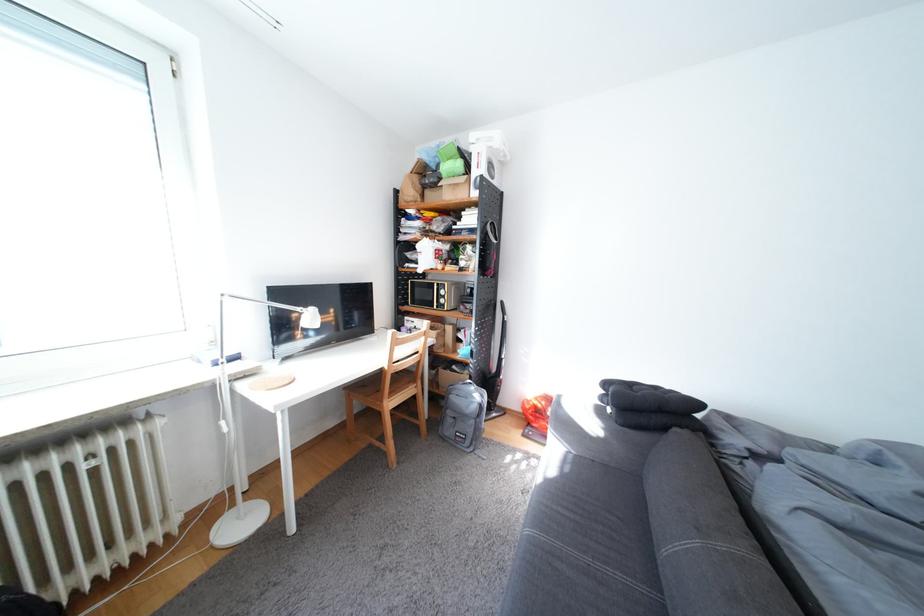
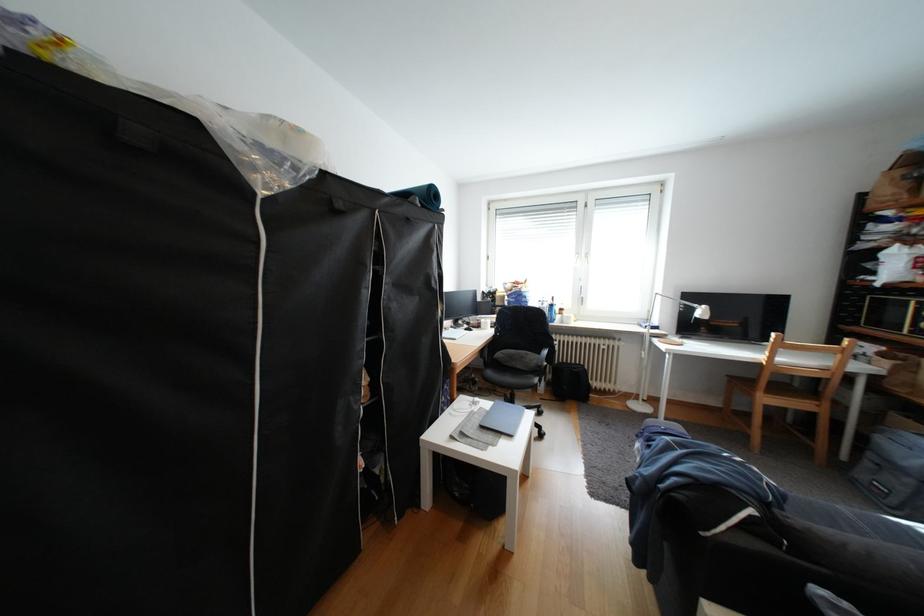
Find the pixel in the second image that matches point 256,387 in the first image.

(667, 341)